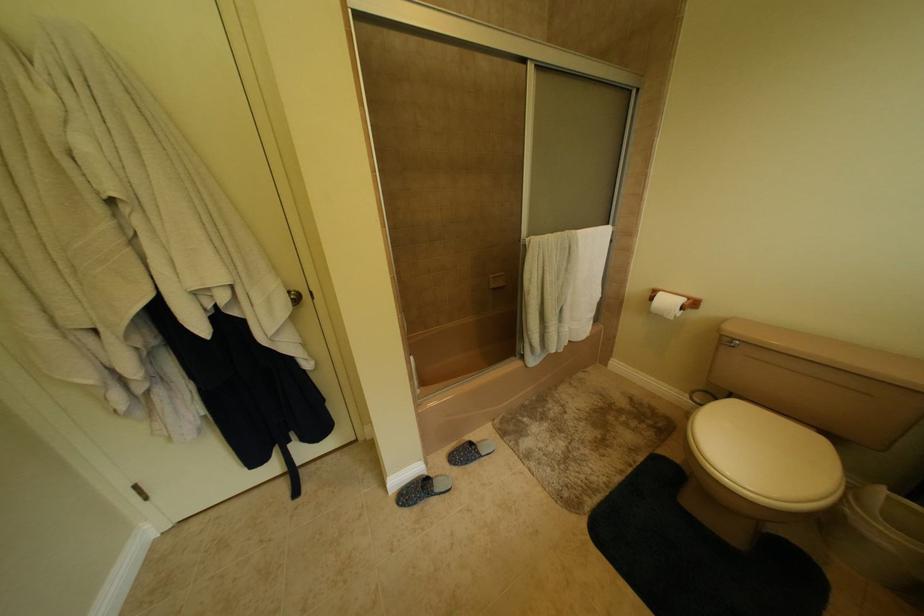
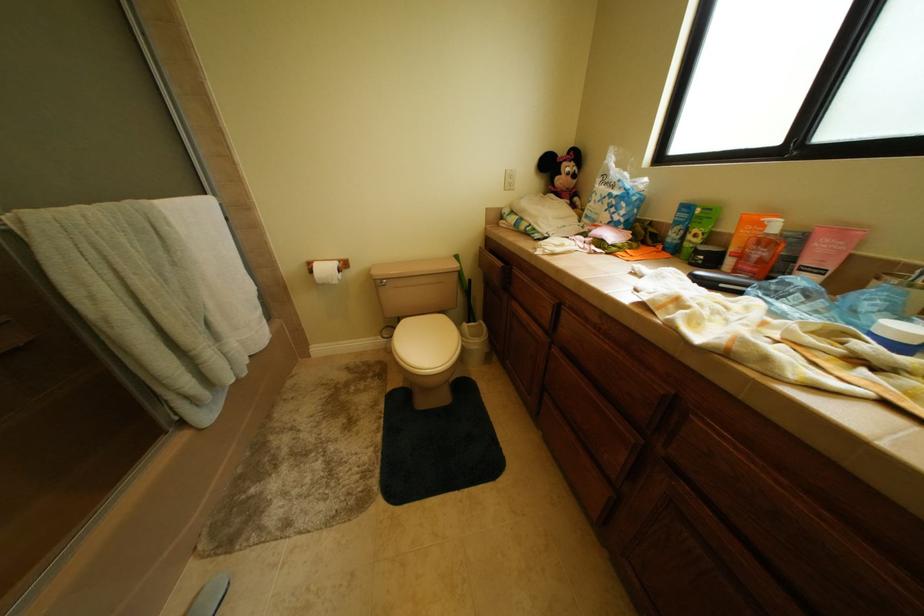
The first image is from the beginning of the video and the second image is from the end. How did the camera likely rotate when shooting the video?

The camera rotated toward right-down.